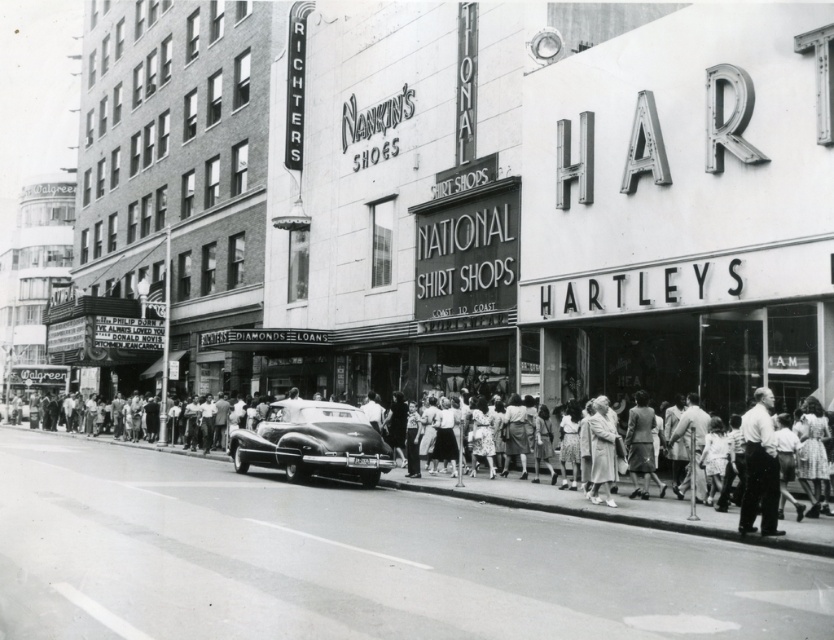
Question: Which point is closer to the camera?

Choices:
 (A) white cotton shirt at center
 (B) shiny black car at center

Answer: (A)

Question: Does shiny black car at center appear on the left side of white cotton shirt at center?

Choices:
 (A) yes
 (B) no

Answer: (A)

Question: Is shiny black car at center to the left of white cotton shirt at center from the viewer's perspective?

Choices:
 (A) no
 (B) yes

Answer: (B)

Question: Does shiny black car at center have a lesser width compared to white cotton shirt at center?

Choices:
 (A) no
 (B) yes

Answer: (B)

Question: Which point is closer to the camera?

Choices:
 (A) shiny black car at center
 (B) white cotton shirt at center

Answer: (B)

Question: Which object is farther from the camera taking this photo?

Choices:
 (A) shiny black car at center
 (B) white cotton shirt at center

Answer: (A)